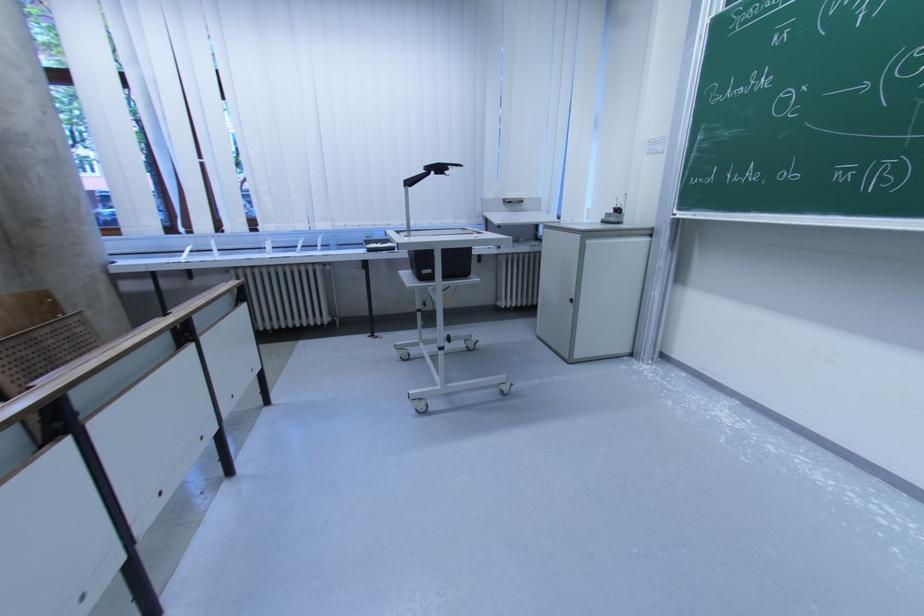
This screenshot has height=616, width=924. Describe the element at coordinates (614, 215) in the screenshot. I see `the machine crank handle` at that location.